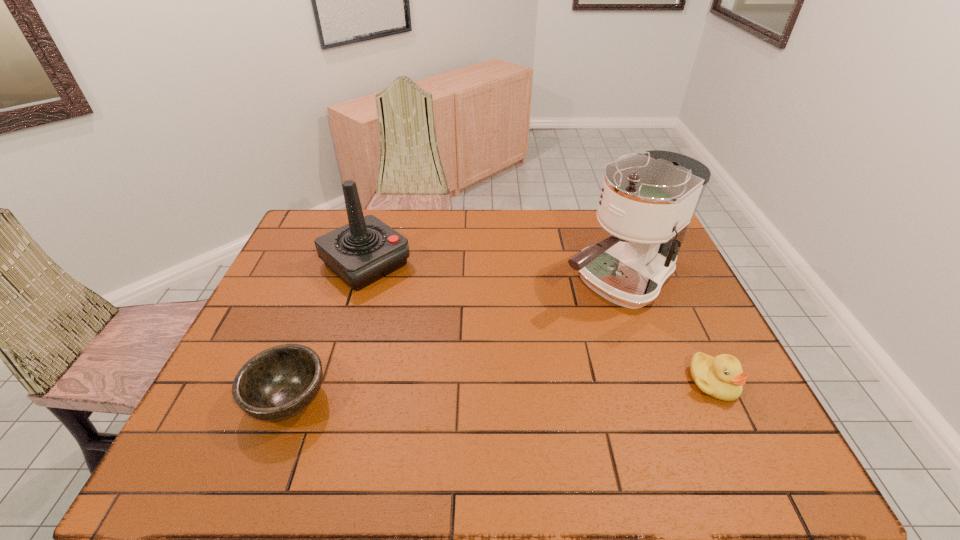
Locate an element on the screen. the shortest object is located at coordinates (278, 383).

Identify the location of duckling. The image size is (960, 540). (721, 377).

The height and width of the screenshot is (540, 960). In order to click on joystick in this screenshot , I will do `click(365, 250)`.

Locate an element on the screen. the tallest object is located at coordinates (647, 202).

Find the location of `free region located on the right of the bowl`. free region located on the right of the bowl is located at coordinates (363, 399).

At what (x,y) coordinates should I click in order to perform the action: click on vacant space located on the front-facing side of the joystick. Please return your answer as a coordinate pair (x, y). The image size is (960, 540). Looking at the image, I should click on (424, 310).

At what (x,y) coordinates should I click in order to perform the action: click on free space located 0.400m on the front-facing side of the joystick. Please return your answer as a coordinate pair (x, y). Looking at the image, I should click on (487, 361).

You are a GUI agent. You are given a task and a screenshot of the screen. Output one action in this format:
    pyautogui.click(x=<x>, y=<y>)
    Task: Click on the vacant region located on the front-facing side of the joystick
    This screenshot has height=540, width=960.
    Given the screenshot: What is the action you would take?
    pyautogui.click(x=449, y=332)

In order to click on vacant space located on the front-facing side of the tallest object in this screenshot , I will do `click(540, 325)`.

The height and width of the screenshot is (540, 960). What are the coordinates of `free space located 0.180m on the front-facing side of the tallest object` in the screenshot? It's located at (527, 333).